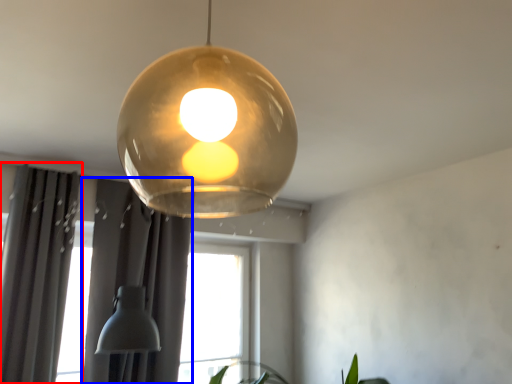
Question: Among these objects, which one is farthest to the camera, curtain (highlighted by a red box) or curtain (highlighted by a blue box)?

Choices:
 (A) curtain
 (B) curtain

Answer: (B)